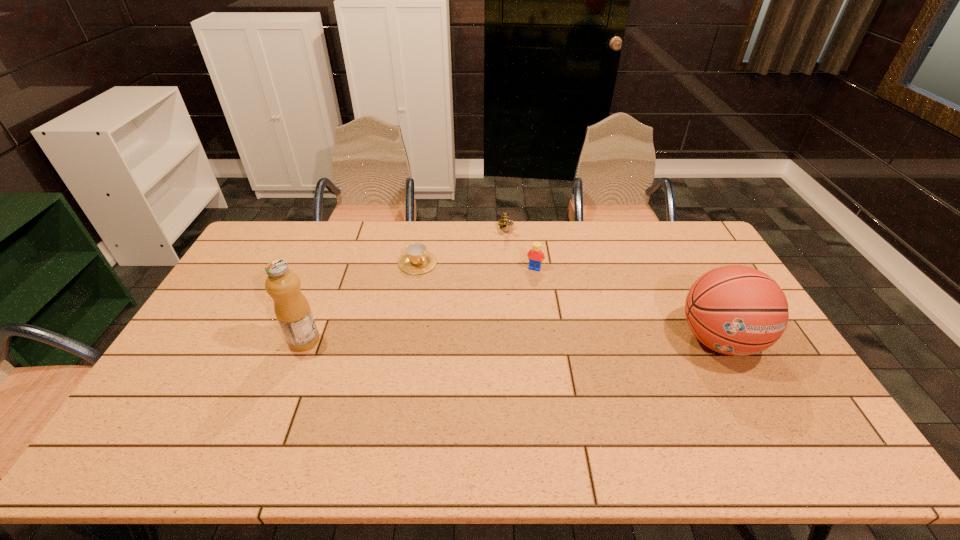
Image resolution: width=960 pixels, height=540 pixels. In order to click on vacant space located on the logo side of the rightmost object in this screenshot , I will do `click(750, 397)`.

Where is `free location located 0.330m with the handle on the side of the fourth object from right to left`? This screenshot has width=960, height=540. free location located 0.330m with the handle on the side of the fourth object from right to left is located at coordinates (484, 332).

The width and height of the screenshot is (960, 540). Find the location of `free location located 0.310m with the handle on the side of the fourth object from right to left`. free location located 0.310m with the handle on the side of the fourth object from right to left is located at coordinates (480, 327).

The height and width of the screenshot is (540, 960). I want to click on vacant space situated with the handle on the side of the fourth object from right to left, so click(449, 296).

Find the location of a particular element. vacant space situated 0.160m on the face of the Lego is located at coordinates (518, 302).

Where is `vacant space located 0.210m on the face of the Lego`? This screenshot has height=540, width=960. vacant space located 0.210m on the face of the Lego is located at coordinates (515, 313).

Image resolution: width=960 pixels, height=540 pixels. Identify the location of blank space located 0.190m on the face of the Lego. tap(516, 308).

In order to click on vacant space situated 0.070m on the face of the third object from left to right in this screenshot , I will do `click(512, 251)`.

Identify the location of free space located on the face of the third object from left to right. (533, 308).

The height and width of the screenshot is (540, 960). Identify the location of free spot located on the face of the third object from left to right. (532, 306).